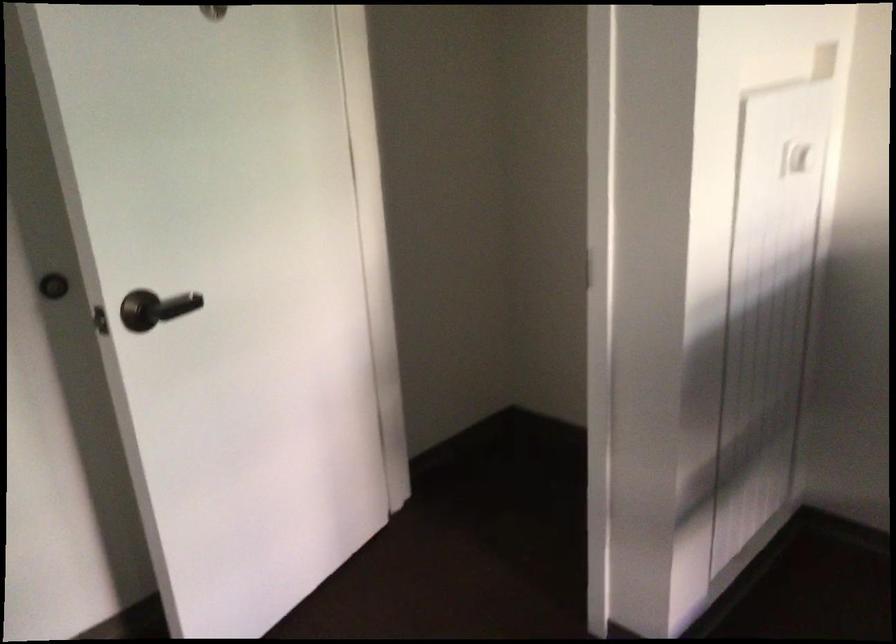
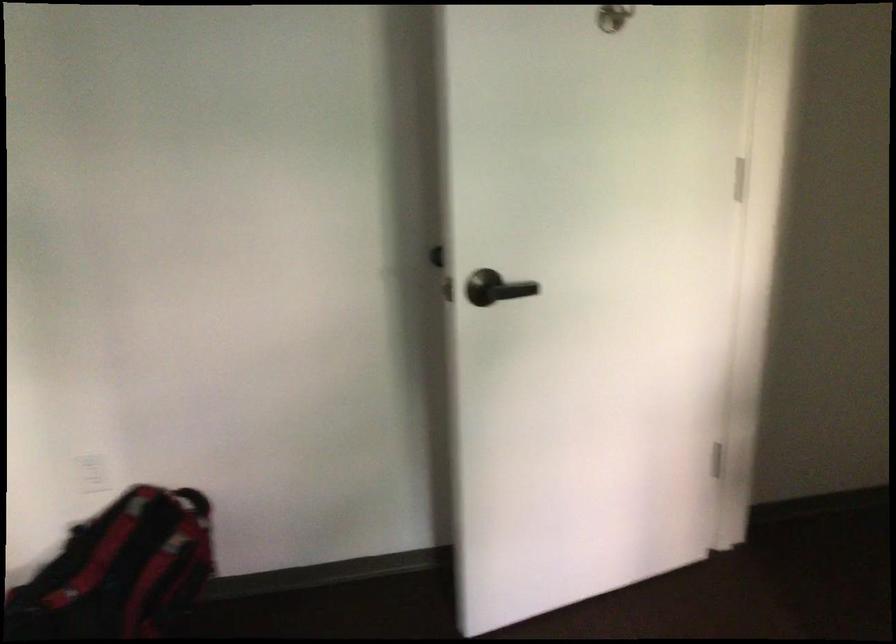
Question: Based on the continuous images, in which direction is the camera rotating? Reply with the corresponding letter.

Choices:
 (A) Left
 (B) Right
 (C) Up
 (D) Down

Answer: (A)